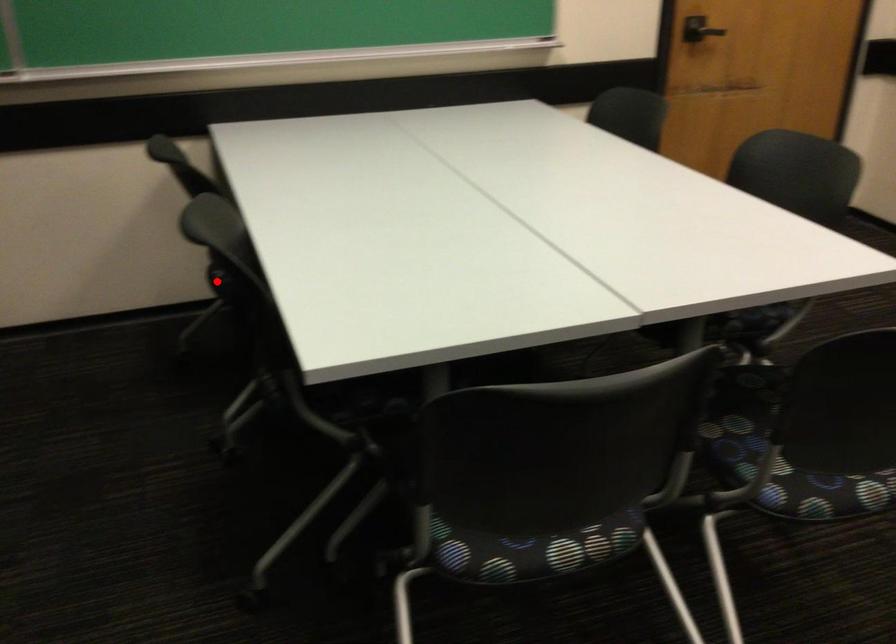
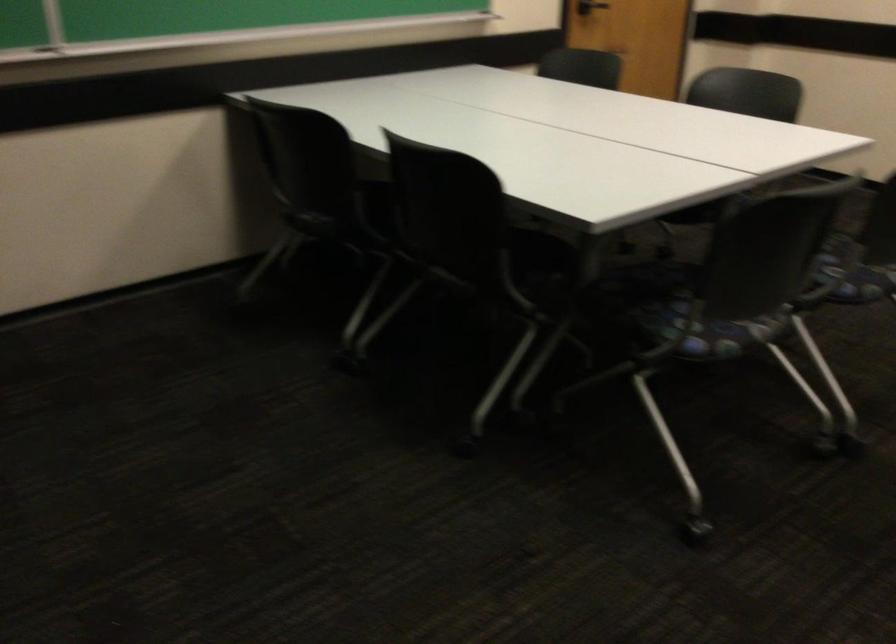
Question: I am providing you with two images of the same scene from different viewpoints. Given a red point in image1, look at the same physical point in image2. Is it:

Choices:
 (A) Closer to the viewpoint
 (B) Farther from the viewpoint

Answer: (B)